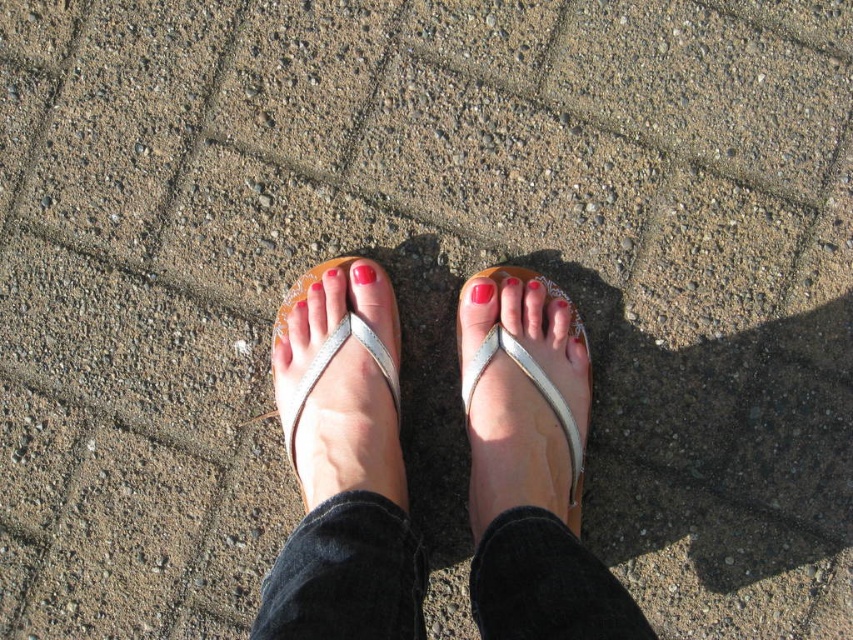
Can you confirm if shiny metallic sandals at center is shorter than matte white toe at center?

No, shiny metallic sandals at center is not shorter than matte white toe at center.

Is shiny metallic sandals at center wider than matte white toe at center?

Yes, shiny metallic sandals at center is wider than matte white toe at center.

Is point (399, 576) in front of point (364, 262)?

Yes, it is in front of point (364, 262).

Where is `shiny metallic sandals at center`? The height and width of the screenshot is (640, 853). shiny metallic sandals at center is located at coordinates (341, 467).

Can you confirm if silver metallic flip-flop at center is wider than shiny silver sandal at center?

Incorrect, silver metallic flip-flop at center's width does not surpass shiny silver sandal at center's.

Between point (518, 280) and point (321, 340), which one is positioned behind?

The point (518, 280) is more distant.

In order to click on silver metallic flip-flop at center in this screenshot , I will do `click(524, 396)`.

Describe the element at coordinates (339, 384) in the screenshot. I see `shiny silver sandal at center` at that location.

Who is positioned more to the right, shiny silver sandal at center or matte white toe at center?

matte white toe at center

In order to click on shiny silver sandal at center in this screenshot , I will do `click(339, 384)`.